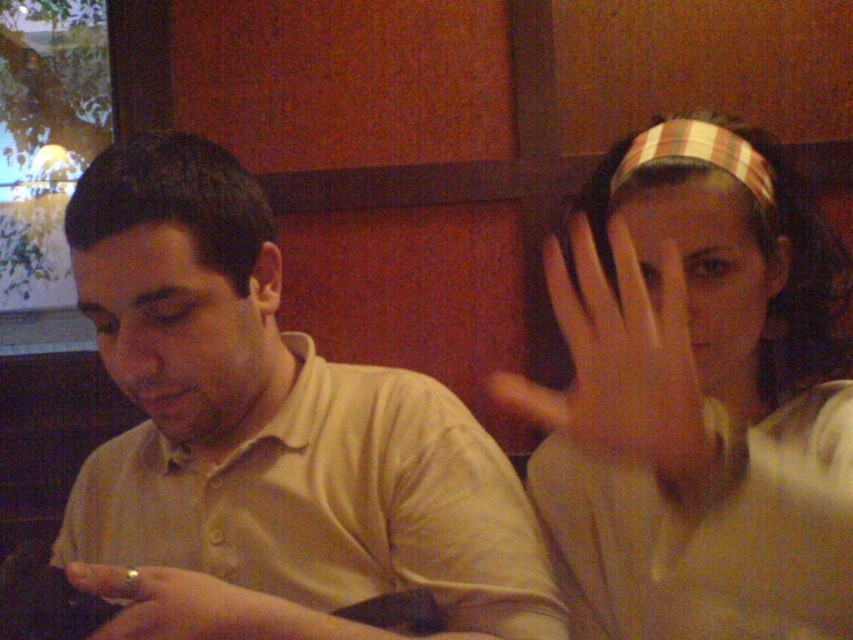
You are a waiter in a restaurant. You need to place a 10 inch long decorative plate between the smooth skin hand at upper right and the gold ring at lower left. Can you fit it there?

The distance between the smooth skin hand at upper right and the gold ring at lower left is 12.40 inches. Since the plate is 10 inches long, it can fit comfortably within that space.

You are a photographer adjusting your camera settings. You notice two points in the scene at coordinates point (x=672, y=572) and point (x=692, y=422). Which of these points is closer to your camera lens?

Point (x=692, y=422) is closer to the camera lens because it is less further than point (x=672, y=572) according to the description.

You are a photographer adjusting your camera settings to capture the striped fabric headband at upper right. Given its position at coordinates point 0.622, 0.817, where exactly should you focus your camera lens to ensure the headband is in sharp focus?

The striped fabric headband at upper right is located at point (695, 397), so the camera lens should be focused precisely on those coordinates to ensure the headband is sharply in focus.